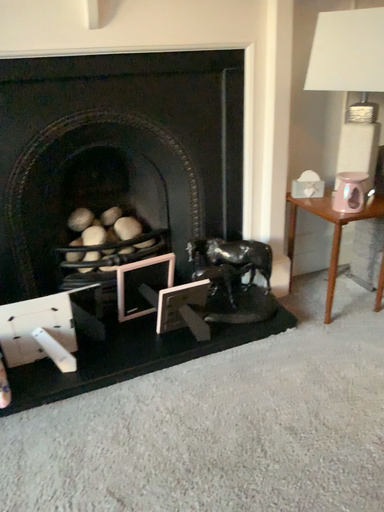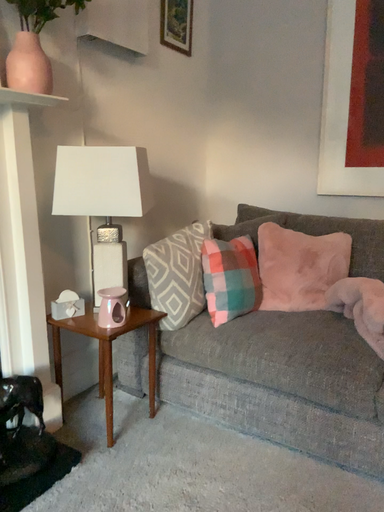
Question: Which way did the camera rotate in the video?

Choices:
 (A) rotated downward
 (B) rotated upward

Answer: (B)